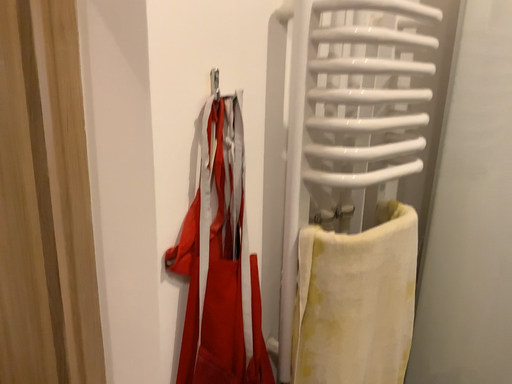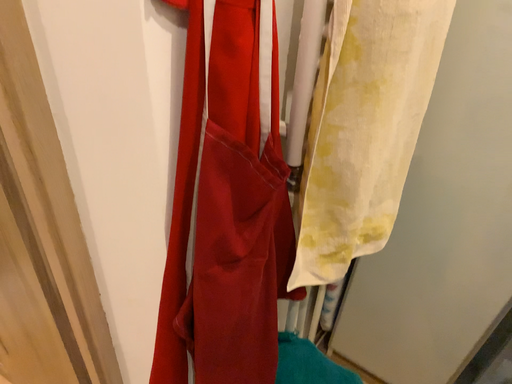
Question: How did the camera likely rotate when shooting the video?

Choices:
 (A) rotated right
 (B) rotated left

Answer: (A)